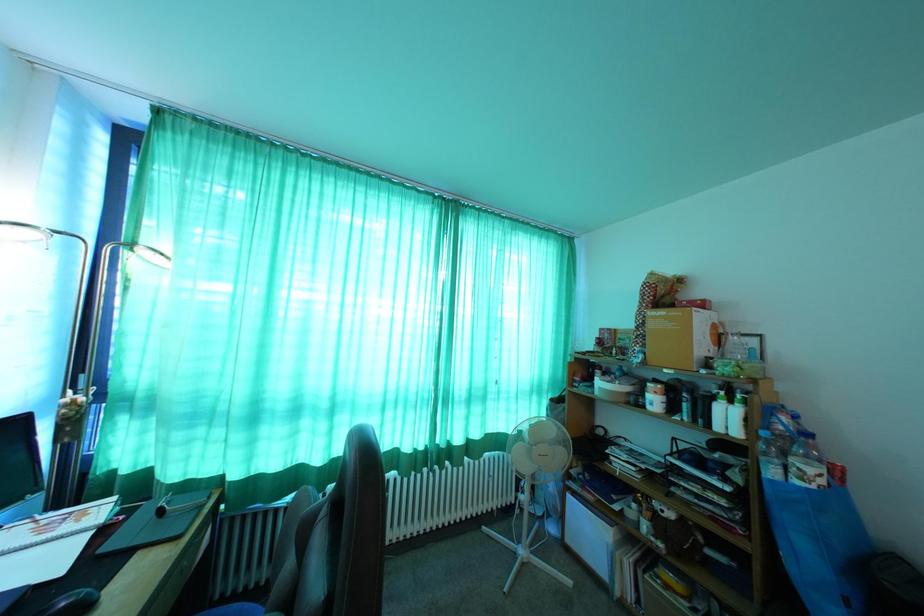
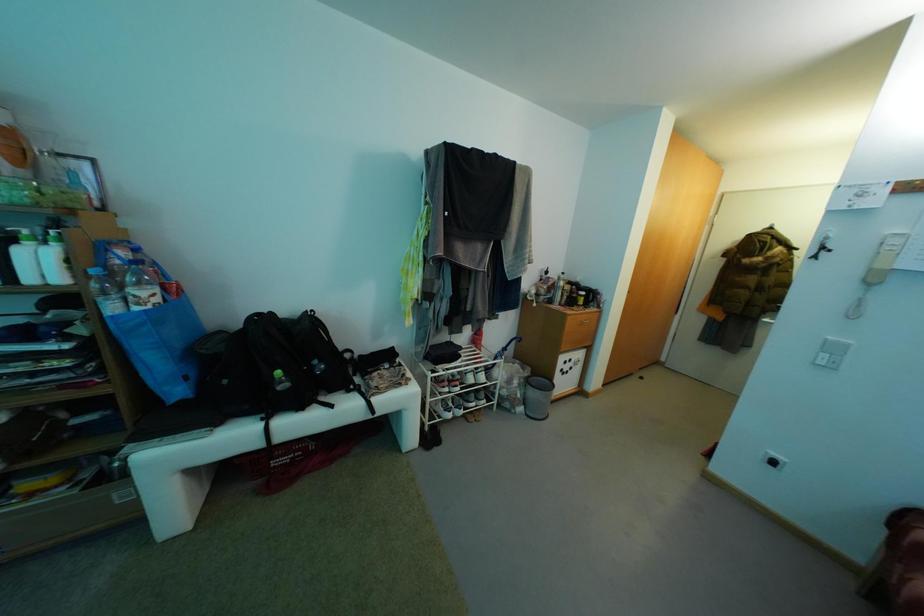
The first image is from the beginning of the video and the second image is from the end. How did the camera likely rotate when shooting the video?

The camera rotated toward right-down.